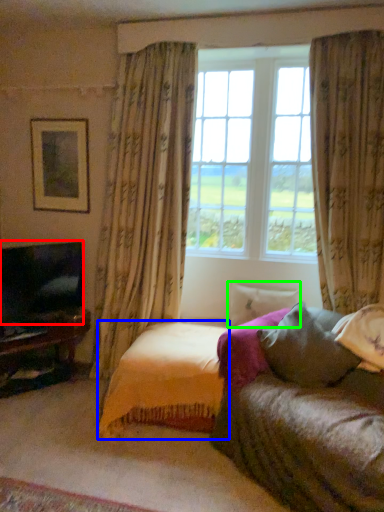
Question: Which object is positioned closest to television (highlighted by a red box)? Select from bedding (highlighted by a blue box) and pillow (highlighted by a green box).

Choices:
 (A) bedding
 (B) pillow

Answer: (A)